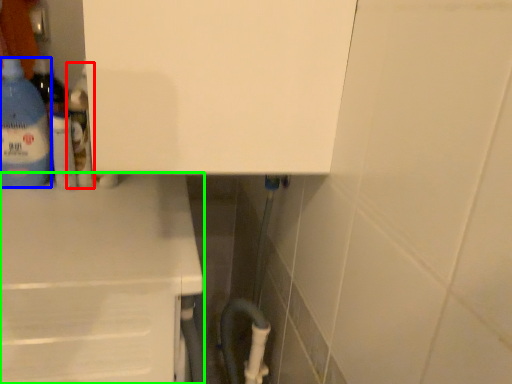
Question: Estimate the real-world distances between objects in this image. Which object is farther from bottle (highlighted by a red box), bottle (highlighted by a blue box) or counter (highlighted by a green box)?

Choices:
 (A) bottle
 (B) counter

Answer: (B)